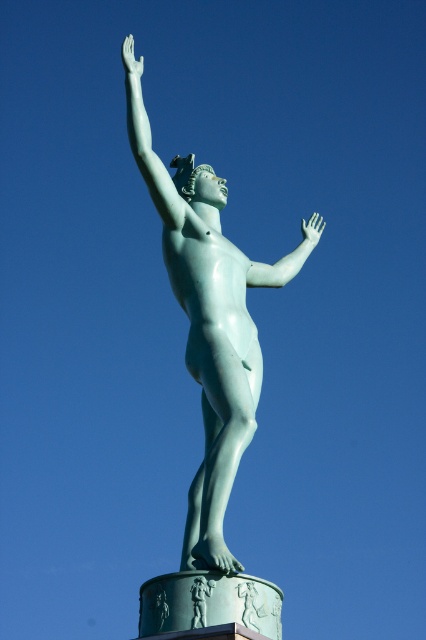
Describe the element at coordinates (209, 602) in the screenshot. The width and height of the screenshot is (426, 640). I see `green polished stone pedestal at lower center` at that location.

Is green polished stone pedestal at lower center smaller than green polished statue arm at upper left?

Indeed, green polished stone pedestal at lower center has a smaller size compared to green polished statue arm at upper left.

From the picture: Measure the distance between green polished stone pedestal at lower center and camera.

The distance of green polished stone pedestal at lower center from camera is 52.38 meters.

What are the coordinates of `green polished stone pedestal at lower center` in the screenshot? It's located at (209, 602).

Can you confirm if green polished stone pedestal at lower center is thinner than smooth white arm at center?

In fact, green polished stone pedestal at lower center might be wider than smooth white arm at center.

Identify the location of green polished stone pedestal at lower center. (209, 602).

Between point (149, 592) and point (284, 273), which one is positioned in front?

Point (149, 592)

You are a GUI agent. You are given a task and a screenshot of the screen. Output one action in this format:
    pyautogui.click(x=<x>, y=<y>)
    Task: Click on the green polished stone pedestal at lower center
    This screenshot has width=426, height=640.
    Given the screenshot: What is the action you would take?
    pyautogui.click(x=209, y=602)

Is green patina statue at center shorter than green polished stone pedestal at lower center?

In fact, green patina statue at center may be taller than green polished stone pedestal at lower center.

Does green patina statue at center come in front of green polished stone pedestal at lower center?

No, green patina statue at center is further to the viewer.

Which is in front, point (213, 378) or point (143, 624)?

Point (143, 624) is in front.

This screenshot has width=426, height=640. What are the coordinates of `green patina statue at center` in the screenshot? It's located at (210, 317).